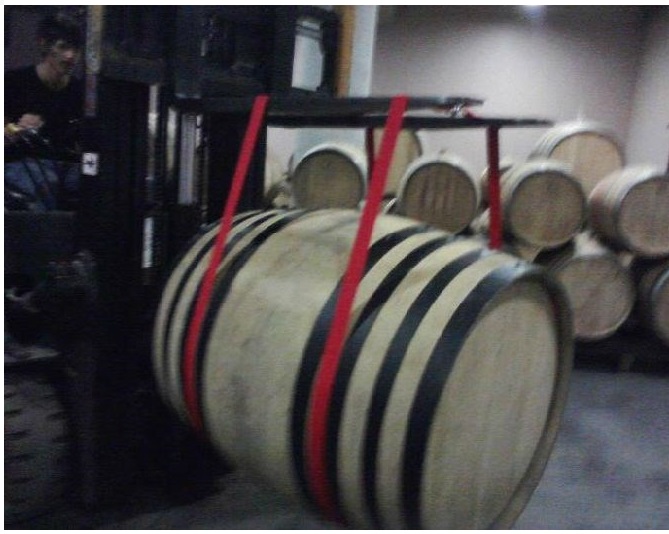
I want to click on wall, so click(540, 72), click(652, 95).